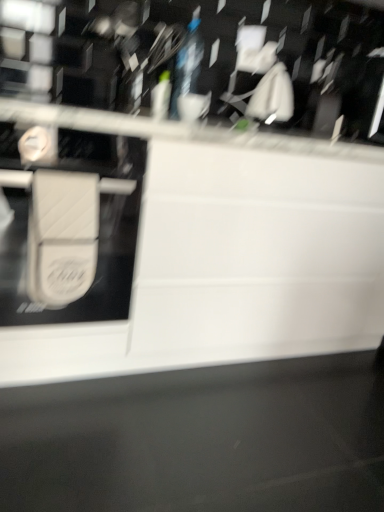
Question: From the image's perspective, is white matte/soft plastic at left positioned above or below white matte drawer at center?

Choices:
 (A) below
 (B) above

Answer: (A)

Question: Would you say white matte/soft plastic at left is to the left or to the right of white matte drawer at center in the picture?

Choices:
 (A) right
 (B) left

Answer: (B)

Question: In terms of height, does white matte/soft plastic at left look taller or shorter compared to white matte drawer at center?

Choices:
 (A) tall
 (B) short

Answer: (B)

Question: From a real-world perspective, is white matte drawer at center physically located above or below white matte/soft plastic at left?

Choices:
 (A) above
 (B) below

Answer: (B)

Question: In the image, is white matte drawer at center positioned in front of or behind white matte/soft plastic at left?

Choices:
 (A) front
 (B) behind

Answer: (A)

Question: Considering the positions of white matte drawer at center and white matte/soft plastic at left in the image, is white matte drawer at center wider or thinner than white matte/soft plastic at left?

Choices:
 (A) thin
 (B) wide

Answer: (B)

Question: From the image's perspective, relative to white matte/soft plastic at left, is white matte drawer at center above or below?

Choices:
 (A) below
 (B) above

Answer: (B)